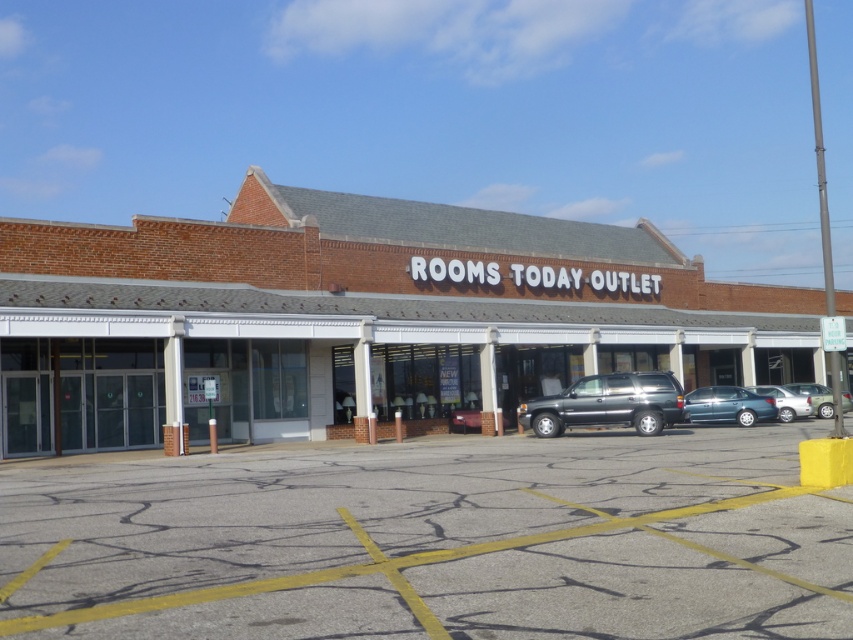
You are standing at the entrance of the brick building at center. If you walk straight ahead, will you be facing the parking lot or the sky?

Since the brick building at center is positioned at point 0.417 on the vertical axis, walking straight ahead from the entrance would face you toward the parking lot located in front of the building, not the sky.